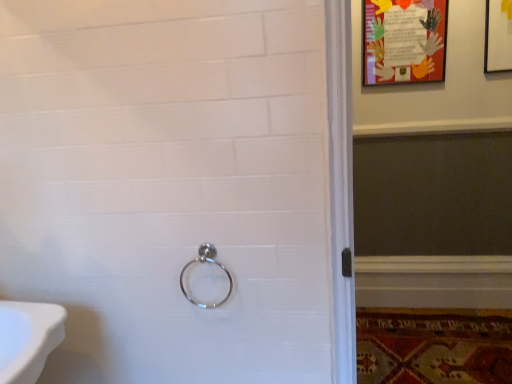
Question: From the image's perspective, is colorful paper poster at upper right on carpeted mat at lower right?

Choices:
 (A) no
 (B) yes

Answer: (B)

Question: Is colorful paper poster at upper right not near carpeted mat at lower right?

Choices:
 (A) yes
 (B) no

Answer: (A)

Question: Is colorful paper poster at upper right looking in the opposite direction of carpeted mat at lower right?

Choices:
 (A) no
 (B) yes

Answer: (A)

Question: Is colorful paper poster at upper right bigger than carpeted mat at lower right?

Choices:
 (A) no
 (B) yes

Answer: (A)

Question: Does colorful paper poster at upper right come behind carpeted mat at lower right?

Choices:
 (A) no
 (B) yes

Answer: (B)

Question: Based on their sizes in the image, would you say polished metal ring at center is bigger or smaller than carpeted mat at lower right?

Choices:
 (A) big
 (B) small

Answer: (B)

Question: From a real-world perspective, is polished metal ring at center physically located above or below carpeted mat at lower right?

Choices:
 (A) below
 (B) above

Answer: (B)

Question: Considering their positions, is polished metal ring at center located in front of or behind carpeted mat at lower right?

Choices:
 (A) behind
 (B) front

Answer: (B)

Question: Is polished metal ring at center spatially inside carpeted mat at lower right, or outside of it?

Choices:
 (A) inside
 (B) outside

Answer: (B)

Question: Relative to polished metal ring at center, is carpeted mat at lower right in front or behind?

Choices:
 (A) behind
 (B) front

Answer: (A)

Question: Is carpeted mat at lower right to the left or to the right of polished metal ring at center in the image?

Choices:
 (A) right
 (B) left

Answer: (A)

Question: Is carpeted mat at lower right inside the boundaries of polished metal ring at center, or outside?

Choices:
 (A) outside
 (B) inside

Answer: (A)

Question: Is carpeted mat at lower right taller or shorter than polished metal ring at center?

Choices:
 (A) tall
 (B) short

Answer: (B)

Question: From the image's perspective, is polished metal ring at center located above or below colorful paper poster at upper right?

Choices:
 (A) below
 (B) above

Answer: (A)

Question: Is polished metal ring at center to the left or to the right of colorful paper poster at upper right in the image?

Choices:
 (A) right
 (B) left

Answer: (B)